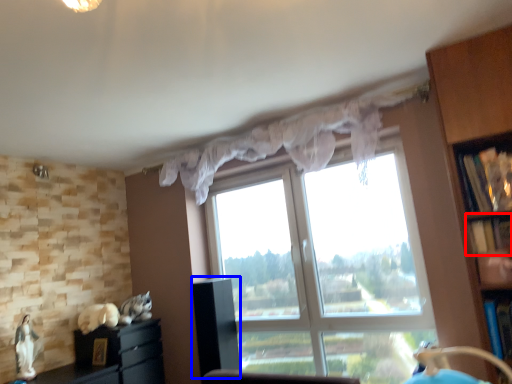
Question: Which object appears farthest to the camera in this image, shelf (highlighted by a red box) or cabinetry (highlighted by a blue box)?

Choices:
 (A) shelf
 (B) cabinetry

Answer: (B)